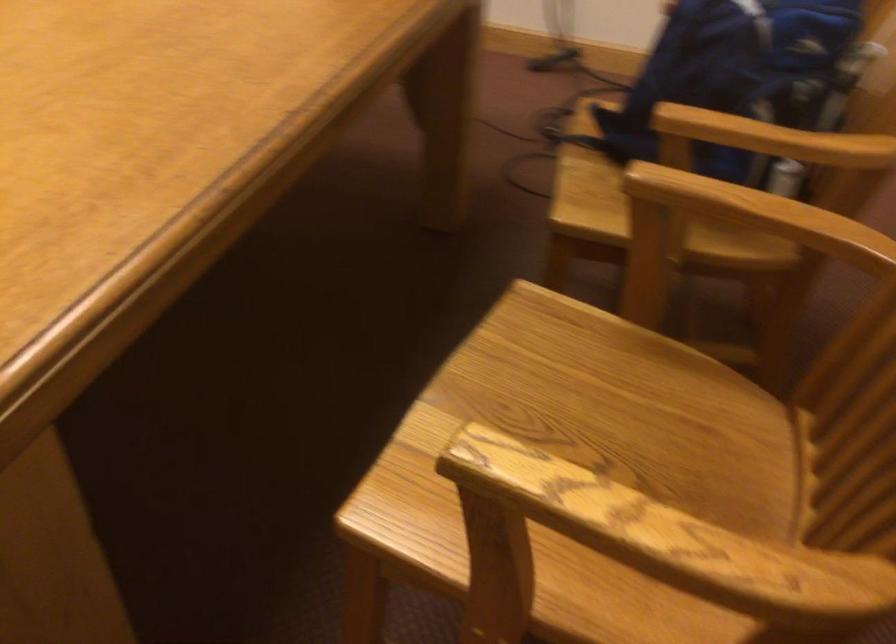
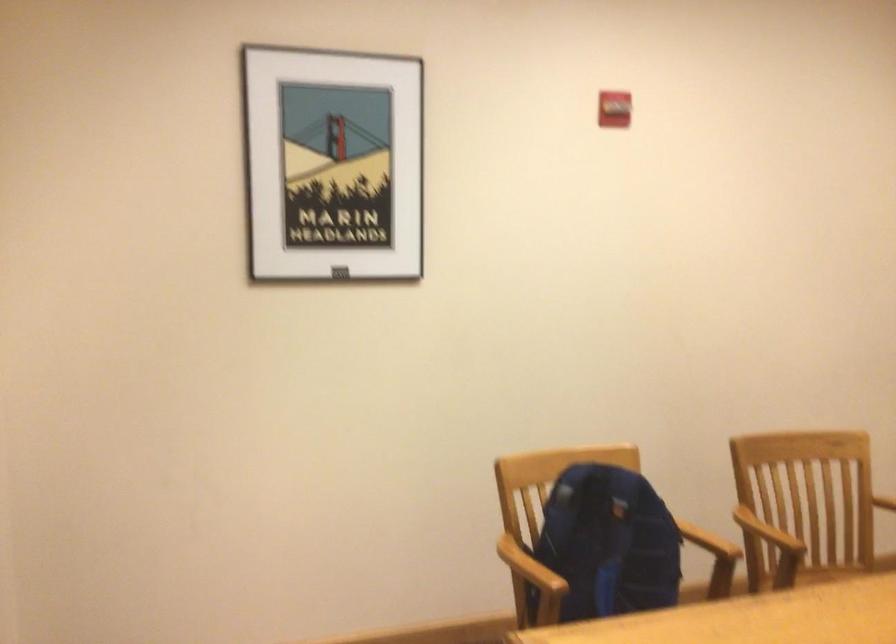
Question: I am providing you with two images of the same scene from different viewpoints. Which of the following objects are not visible in image2?

Choices:
 (A) wooden chair armrest
 (B) chair sitting surface
 (C) blue backpack
 (D) none of these

Answer: (D)